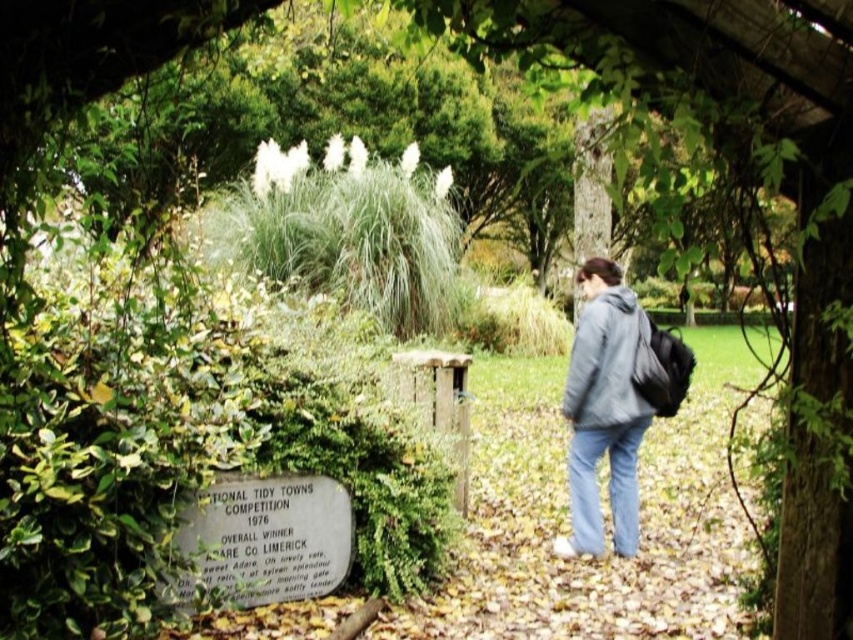
Consider the image. You are a photographer trying to capture the person in the gray fleece jacket at center and blue denim jeans at lower center. Since you want to focus on the jacket, which part of the person should you zoom in on to ensure it appears larger in the photo?

The gray fleece jacket at center is closer to the viewer than the blue denim jeans at lower center, so zooming in on the gray fleece jacket at center will make it appear larger in the photo.

You are a photographer trying to capture the plaque on the wall to the left of the path. There are two gray fleece jackets in your viewfinder. The gray fleece jacket at right and the gray fleece jacket at center. Which one is blocking your view of the plaque?

The gray fleece jacket at right is in front of the gray fleece jacket at center, so the gray fleece jacket at right is blocking your view of the plaque.